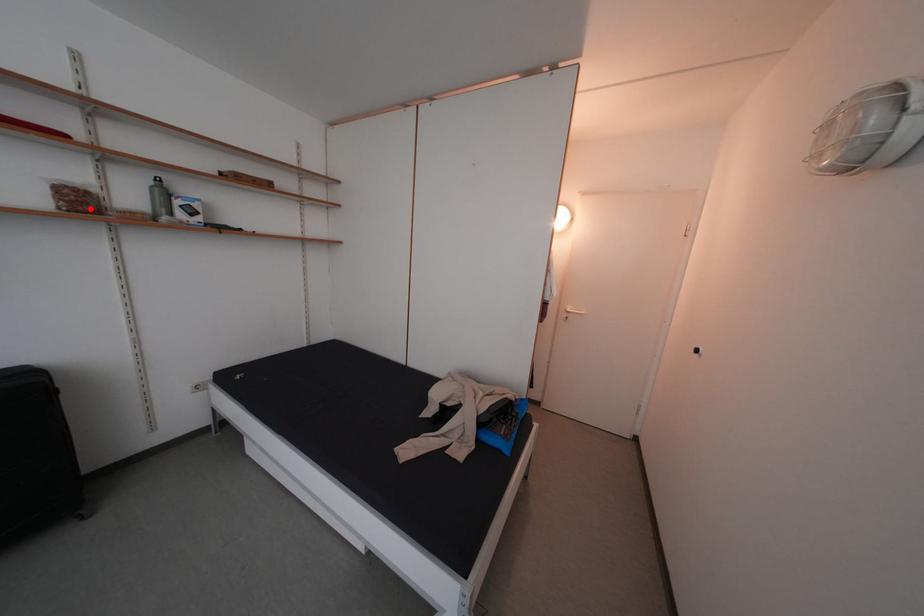
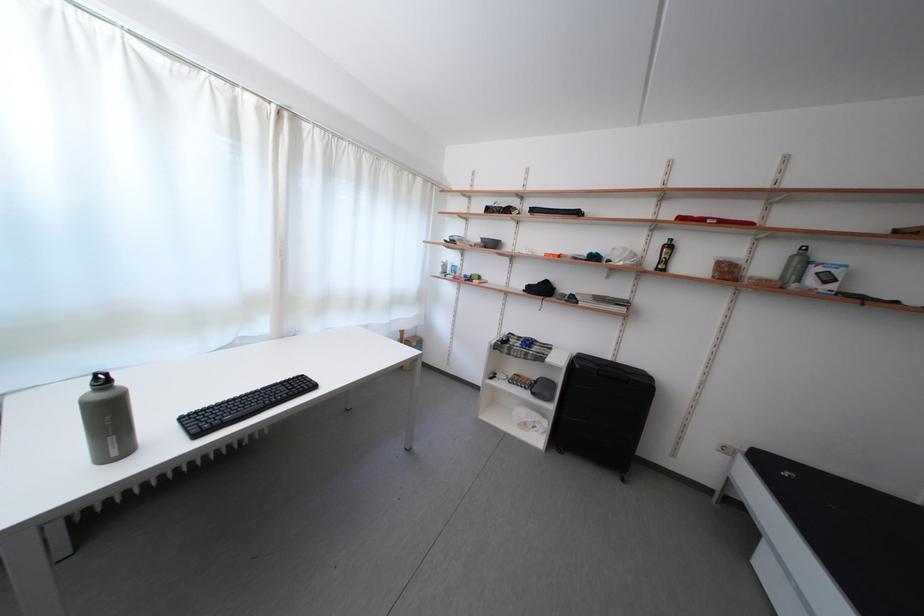
Locate, in the second image, the point that corresponds to the highlighted location in the first image.

(736, 278)